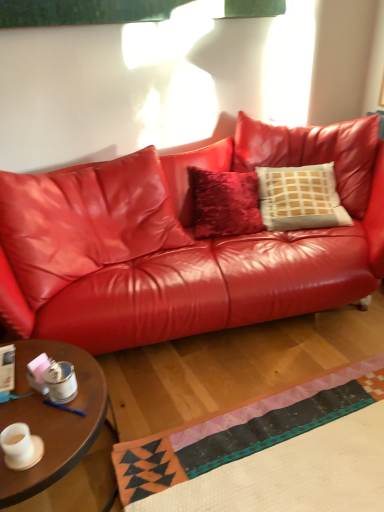
Image resolution: width=384 pixels, height=512 pixels. I want to click on vacant space to the right of matte white cup at lower left, so click(x=69, y=442).